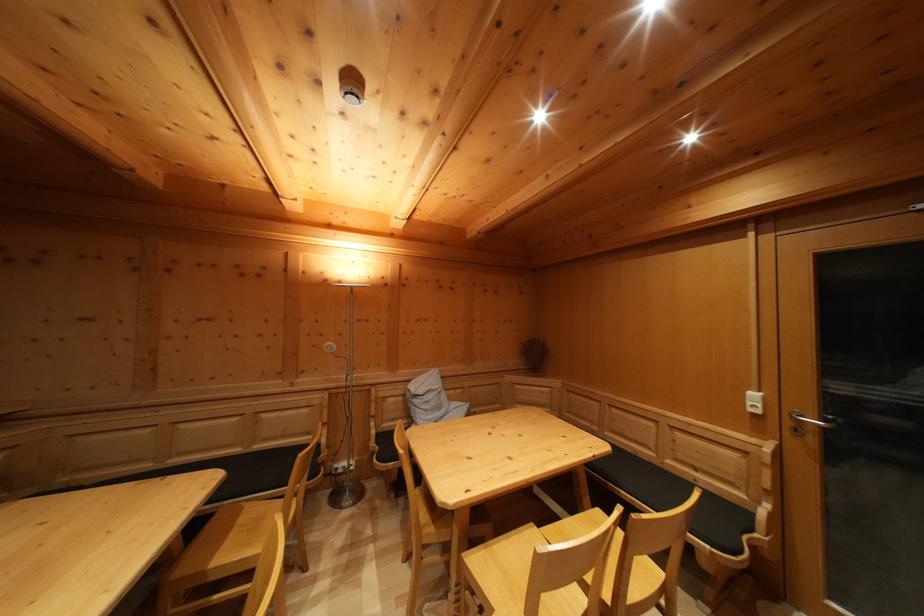
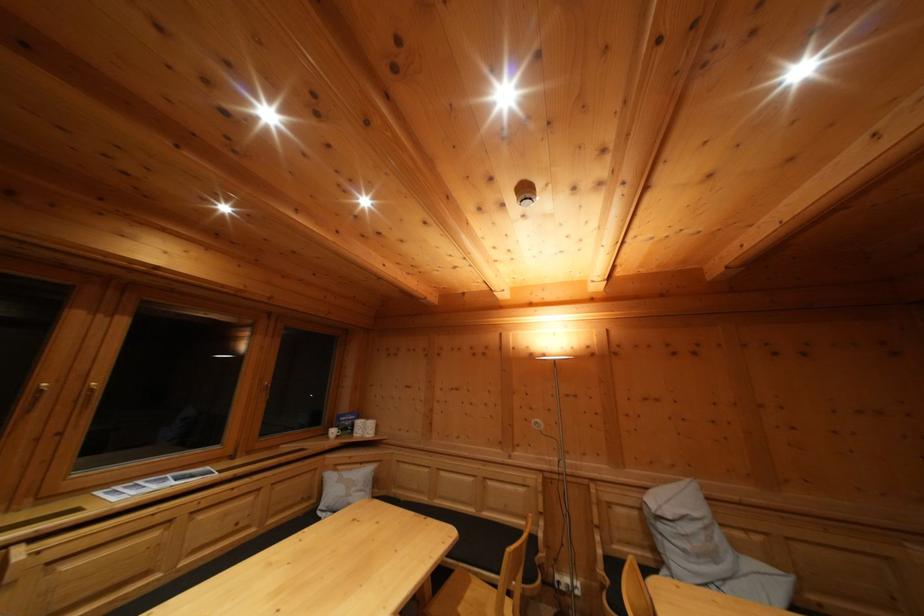
The point at (343, 476) is marked in the first image. Where is the corresponding point in the second image?

(565, 590)